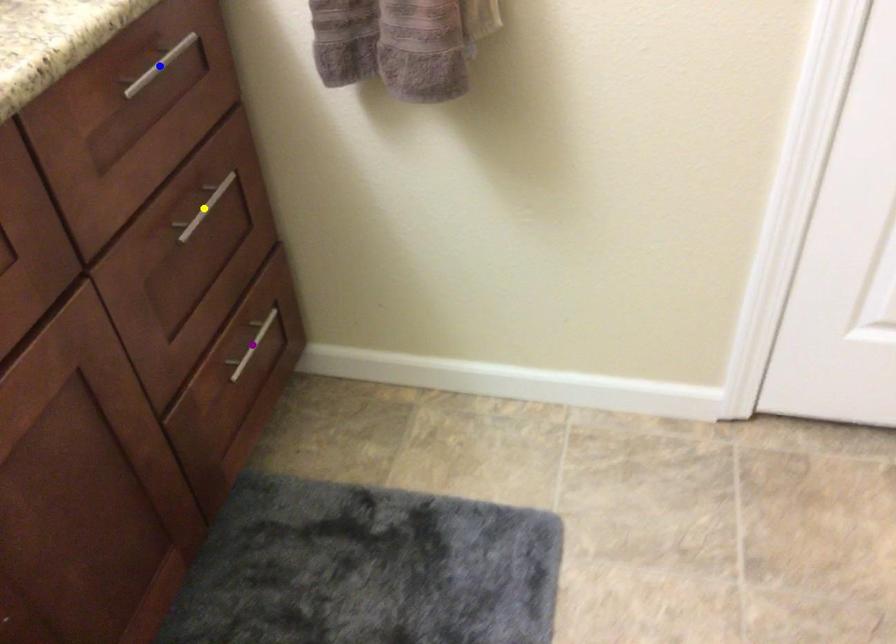
Order these from nearest to farthest:
purple point
yellow point
blue point

blue point < yellow point < purple point